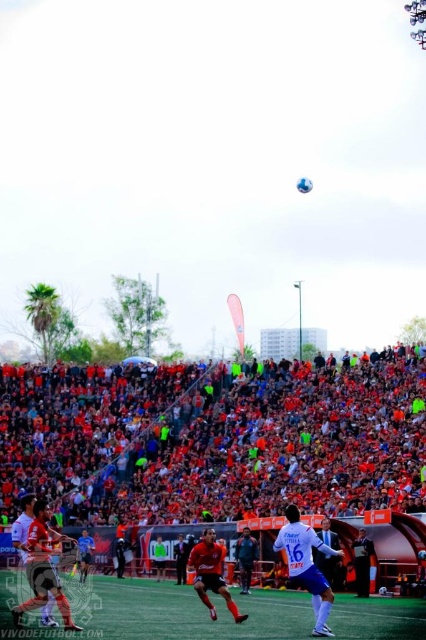
You are a soccer coach analyzing the field layout. You notice the green artificial turf at center and the white matte jersey at center. Which object occupies more area in the image?

The green artificial turf at center is larger in size than the white matte jersey at center, so it occupies more area in the image.

You are a photographer standing at the edge of the soccer field. You want to take a photo of the white matte jersey at center without the orange fabric crowd at center blocking it. Is this possible given their positions?

The orange fabric crowd at center is above the white matte jersey at center, so the crowd would block the view of the jersey. Therefore, it is not possible to take a photo of the white matte jersey at center without the orange fabric crowd at center blocking it.